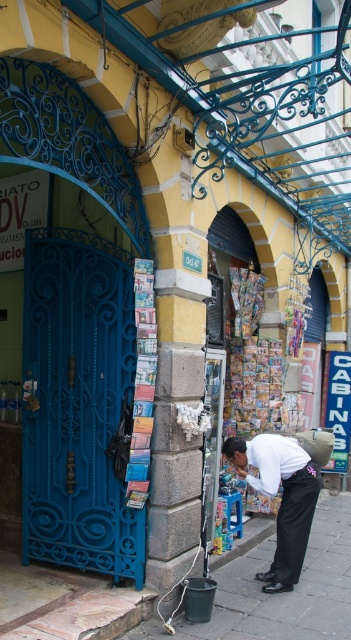
Question: Which point appears closest to the camera in this image?

Choices:
 (A) (235, 508)
 (B) (328, 602)

Answer: (B)

Question: Which of the following is the farthest from the observer?

Choices:
 (A) (230, 528)
 (B) (267, 577)
 (C) (340, 570)

Answer: (A)

Question: Is smooth concrete pavement at lower center below white cotton shirt at center?

Choices:
 (A) no
 (B) yes

Answer: (B)

Question: Which point is farther to the camera?

Choices:
 (A) white cotton shirt at center
 (B) blue plastic stool at lower center
 (C) smooth concrete pavement at lower center

Answer: (B)

Question: Is smooth concrete pavement at lower center smaller than blue plastic stool at lower center?

Choices:
 (A) no
 (B) yes

Answer: (A)

Question: Can you confirm if smooth concrete pavement at lower center is positioned above white cotton shirt at center?

Choices:
 (A) no
 (B) yes

Answer: (A)